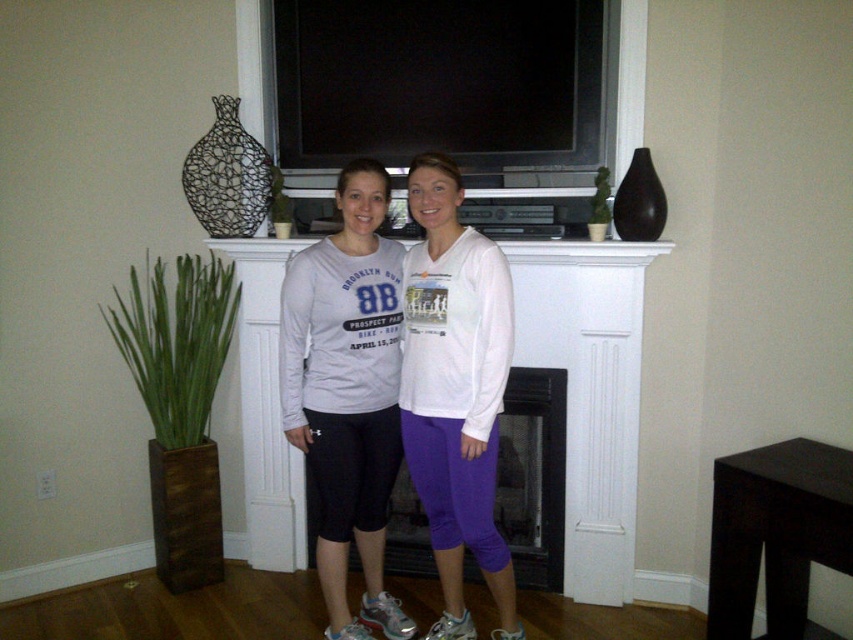
You are standing in the living room and want to place a new decorative item between the purple cotton leggings at center and the black glass fireplace at center. Based on their positions, on which side of the fireplace should you place it?

The purple cotton leggings at center is to the left of the black glass fireplace at center, so you should place the new decorative item to the left side of the fireplace.

You are a tailor measuring the distance between two items in the image. The items are the matte gray sweatshirt at center and the purple cotton leggings at center. The tailor needs to know if the space between them is exactly 9 inches. Can you confirm?

The distance between the matte gray sweatshirt at center and the purple cotton leggings at center is 8.91 inches, which is just slightly less than 9 inches. Therefore, the space is not exactly 9 inches.